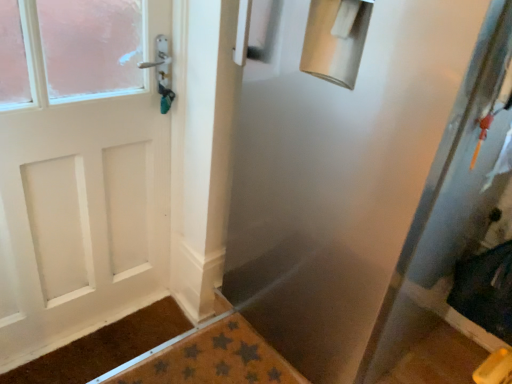
Question: Is transparent plastic screen door at center taller or shorter than brown textured bath mat at lower center?

Choices:
 (A) tall
 (B) short

Answer: (A)

Question: Is transparent plastic screen door at center inside the boundaries of brown textured bath mat at lower center, or outside?

Choices:
 (A) inside
 (B) outside

Answer: (B)

Question: Which object is positioned farthest from the transparent plastic screen door at center?

Choices:
 (A) brown textured mat at lower left
 (B) brown textured bath mat at lower center

Answer: (A)

Question: Based on their relative distances, which object is farther from the brown textured mat at lower left?

Choices:
 (A) brown textured bath mat at lower center
 (B) transparent plastic screen door at center

Answer: (B)